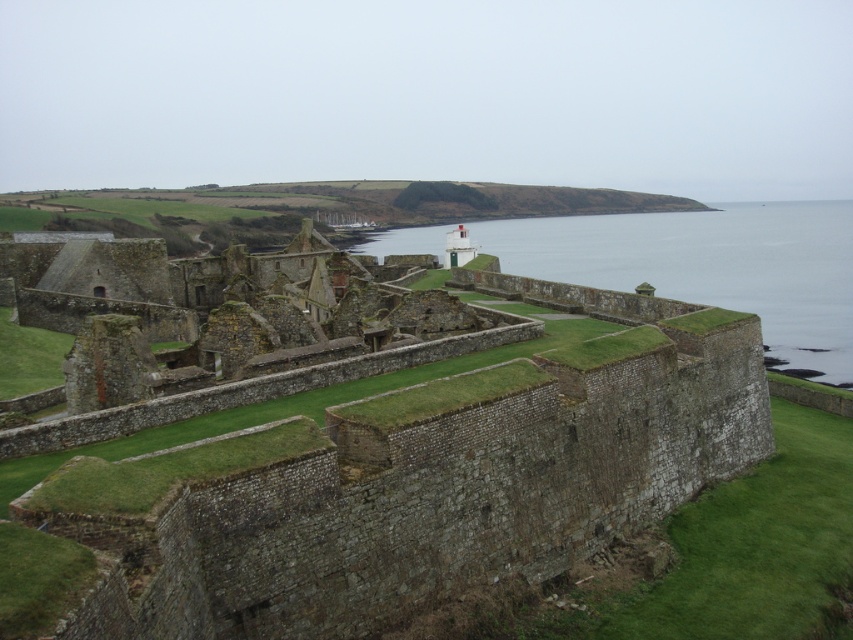
Question: Which point is closer to the camera taking this photo?

Choices:
 (A) (828, 214)
 (B) (238, 355)

Answer: (B)

Question: Does stone wall at center have a greater width compared to clear water at center?

Choices:
 (A) yes
 (B) no

Answer: (B)

Question: Can you confirm if stone wall at center is positioned below clear water at center?

Choices:
 (A) no
 (B) yes

Answer: (B)

Question: In this image, where is stone wall at center located relative to clear water at center?

Choices:
 (A) below
 (B) above

Answer: (A)

Question: Among these points, which one is farthest from the camera?

Choices:
 (A) pyautogui.click(x=730, y=264)
 (B) pyautogui.click(x=172, y=273)

Answer: (A)